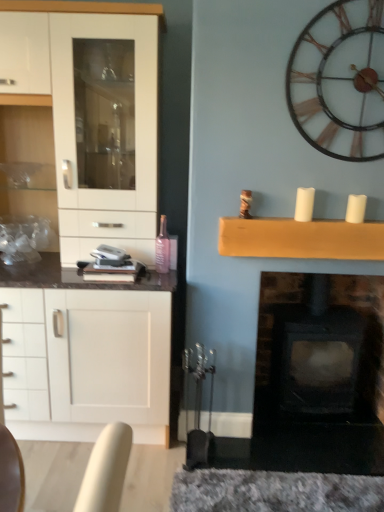
Question: Should I look upward or downward to see white matte candle at upper right, which appears as the first candle when viewed from the right?

Choices:
 (A) down
 (B) up

Answer: (B)

Question: Can you confirm if white matte candle at upper right, positioned as the 2th candle in left-to-right order, is taller than white glossy cabinet at left?

Choices:
 (A) yes
 (B) no

Answer: (B)

Question: From the image's perspective, is white matte candle at upper right, positioned as the 2th candle in left-to-right order, under white glossy cabinet at left?

Choices:
 (A) no
 (B) yes

Answer: (A)

Question: Is white matte candle at upper right, positioned as the 2th candle in left-to-right order, shorter than white glossy cabinet at left?

Choices:
 (A) yes
 (B) no

Answer: (A)

Question: Is white matte candle at upper right, positioned as the 2th candle in left-to-right order, not near white glossy cabinet at left?

Choices:
 (A) no
 (B) yes

Answer: (B)

Question: Is white matte candle at upper right, positioned as the 2th candle in left-to-right order, facing away from white glossy cabinet at left?

Choices:
 (A) no
 (B) yes

Answer: (A)

Question: Could you tell me if white matte candle at upper right, positioned as the 2th candle in left-to-right order, is turned towards white glossy cabinet at left?

Choices:
 (A) yes
 (B) no

Answer: (B)

Question: Is white glossy cabinet at left shorter than pink glass bottle at center?

Choices:
 (A) no
 (B) yes

Answer: (A)

Question: Can you confirm if white glossy cabinet at left is smaller than pink glass bottle at center?

Choices:
 (A) no
 (B) yes

Answer: (A)

Question: Is white glossy cabinet at left closer to camera compared to pink glass bottle at center?

Choices:
 (A) no
 (B) yes

Answer: (B)

Question: Is white glossy cabinet at left in contact with pink glass bottle at center?

Choices:
 (A) yes
 (B) no

Answer: (B)

Question: Does white glossy cabinet at left lie behind pink glass bottle at center?

Choices:
 (A) no
 (B) yes

Answer: (A)

Question: From the image's perspective, is white glossy cabinet at left on top of pink glass bottle at center?

Choices:
 (A) yes
 (B) no

Answer: (A)

Question: Is pink glass bottle at center taller than white matte candle at upper right, which appears as the first candle when viewed from the right?

Choices:
 (A) yes
 (B) no

Answer: (A)